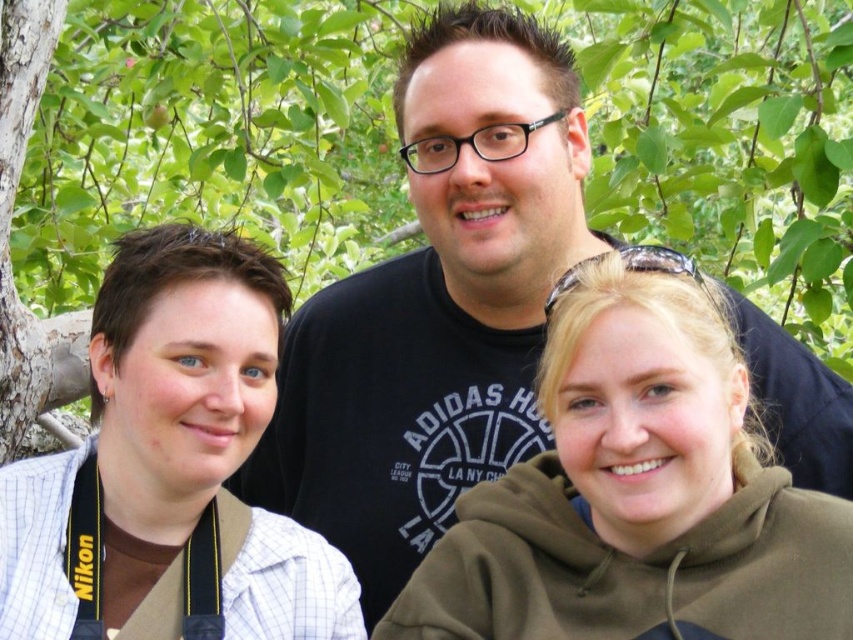
You are a photographer trying to capture a clear shot of the person wearing the black cotton shirt at center. However, the white checkered shirt at left is blocking your view. Can you adjust your position to avoid the obstruction?

The white checkered shirt at left is behind the black cotton shirt at center, so moving your position to the right or left might allow you to see around the obstruction.

You are a photographer trying to capture a group photo of the green matte hoodie at center and the white checkered shirt at left. Based on their positions, which subject should you focus on first if you want to ensure both are in sharp focus?

The green matte hoodie at center is located below the white checkered shirt at left. To ensure both are in sharp focus, you should focus on the white checkered shirt at left since it is farther away, as depth of field typically extends further behind the point of focus than in front.